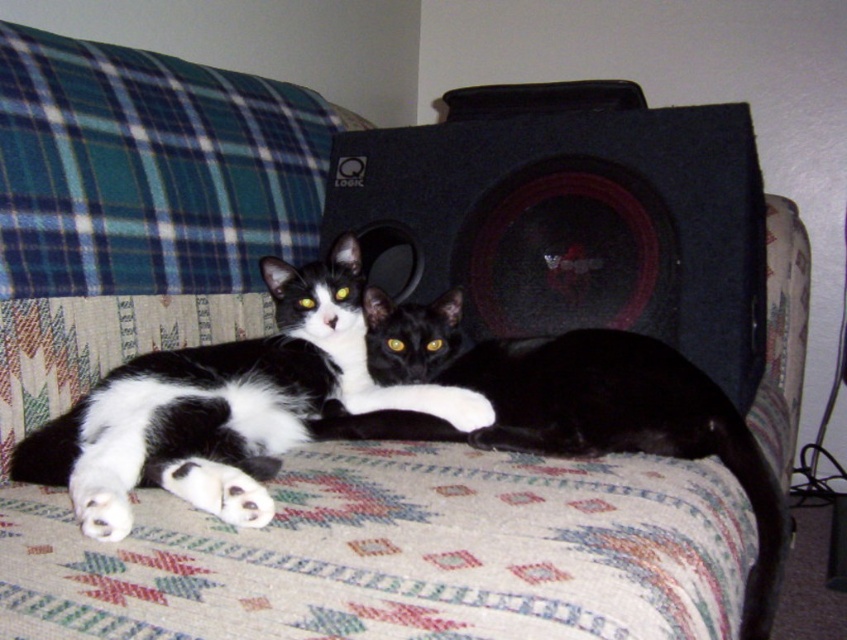
Looking at this image, you are a pet sitter who needs to ensure the cats are safe. The black glossy cat at center is lying on the couch. Is the black matte speaker at center positioned in a way that could potentially fall on the cat?

The black matte speaker at center is located above the black glossy cat at center, so there is a risk that it could fall and hit the cat. You should move the speaker to a safer location.

You are an interior designer planning to place a new rectangular side table next to the black matte speaker at center. The table will be positioned such that its center is exactly 0.1 units to the right of the speaker. What are the coordinates of the table center?

The coordinates of the table center will be at point 0.352 plus 0.1 equals 0.452 in x, and 0.678 in y. So the new coordinates are (573, 289).

Looking at this image, you are standing in front of the couch where the two cats are resting. You notice two points marked on the wall behind the speaker. Which point is closer to you, point (x=403, y=285) or point (x=346, y=292)?

Point (x=403, y=285) is further to the viewer than point (x=346, y=292), so point (x=346, y=292) is closer to you.